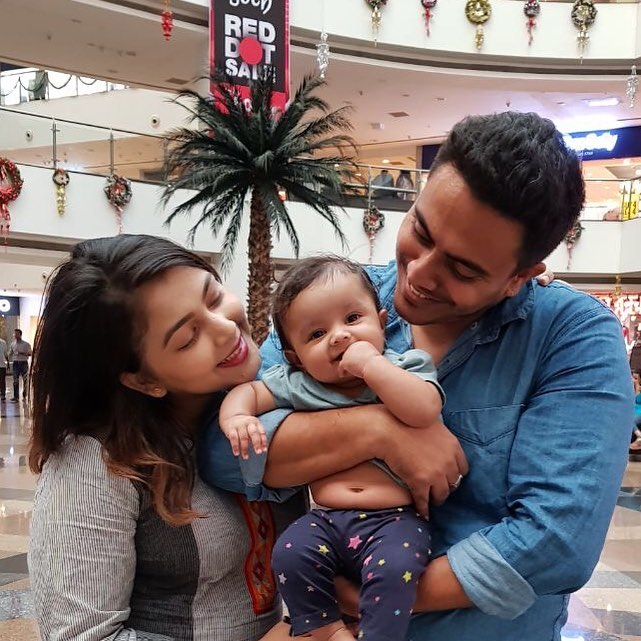
Identify the location of the first floor. (87, 176).